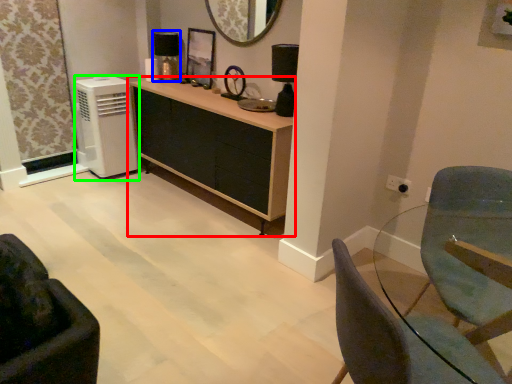
Question: Estimate the real-world distances between objects in this image. Which object is closer to cabinetry (highlighted by a red box), lamp (highlighted by a blue box) or air conditioning (highlighted by a green box)?

Choices:
 (A) lamp
 (B) air conditioning

Answer: (B)